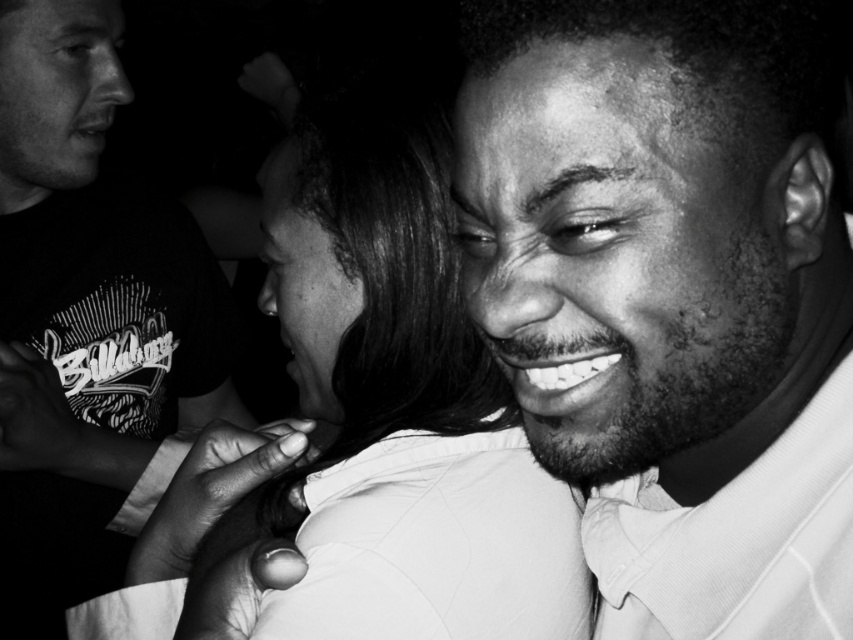
Question: Is smooth skin face at center to the left of matte black shirt at upper left from the viewer's perspective?

Choices:
 (A) no
 (B) yes

Answer: (A)

Question: Which point is closer to the camera taking this photo?

Choices:
 (A) coord(97,288)
 (B) coord(726,179)

Answer: (B)

Question: Considering the real-world distances, which object is farthest from the smooth skin face at center?

Choices:
 (A) smooth skin at center
 (B) matte black shirt at upper left

Answer: (B)

Question: Which is farther from the smooth skin face at center?

Choices:
 (A) smooth skin at center
 (B) matte black shirt at upper left

Answer: (B)

Question: Is smooth skin at center to the left of matte black shirt at upper left from the viewer's perspective?

Choices:
 (A) no
 (B) yes

Answer: (A)

Question: Can you confirm if smooth skin face at center is bigger than matte black shirt at upper left?

Choices:
 (A) no
 (B) yes

Answer: (A)